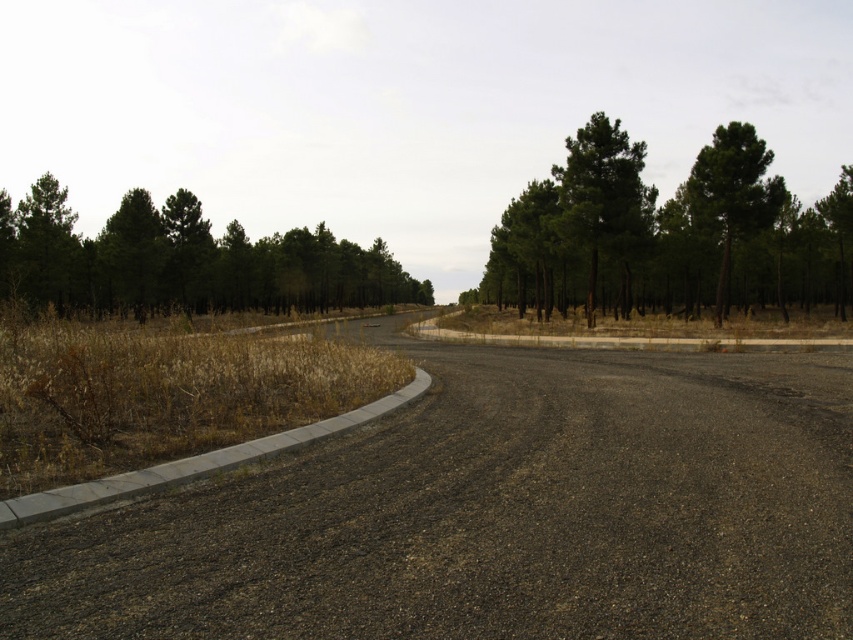
Question: In this image, where is green matte trees at upper left located relative to green matte tree at left?

Choices:
 (A) above
 (B) below

Answer: (B)

Question: Which point appears farthest from the camera in this image?

Choices:
 (A) (135, 257)
 (B) (26, 205)

Answer: (A)

Question: Can you confirm if green leafy tree at upper right is positioned below green matte tree at left?

Choices:
 (A) yes
 (B) no

Answer: (A)

Question: Which object is farther from the camera taking this photo?

Choices:
 (A) green matte trees at upper center
 (B) green leafy tree at upper right

Answer: (A)

Question: Does green matte trees at upper center have a greater width compared to green matte trees at upper left?

Choices:
 (A) yes
 (B) no

Answer: (A)

Question: Which object is the closest to the green rough bark tree at center?

Choices:
 (A) green matte trees at upper center
 (B) green matte trees at upper left
 (C) green matte tree at left
 (D) green leafy tree at upper right

Answer: (D)